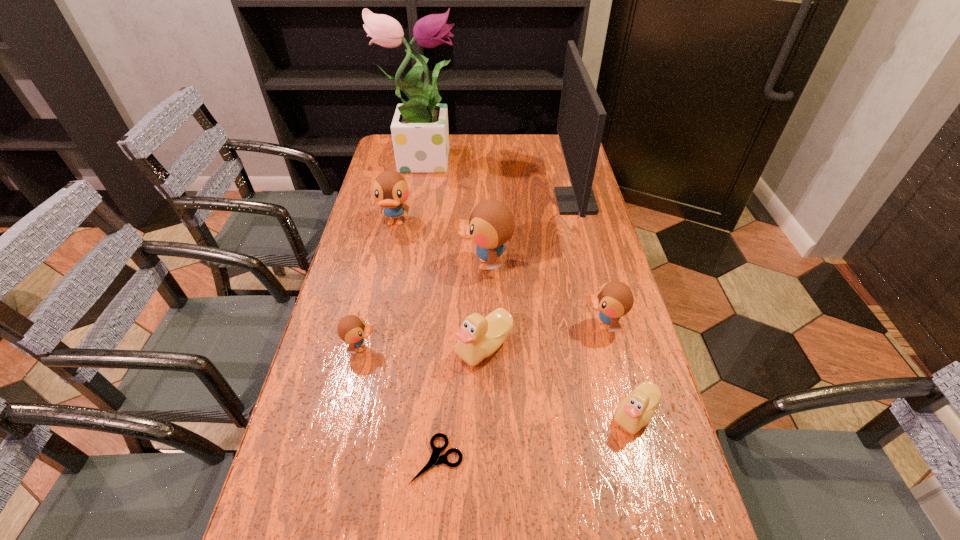
Where is `vacant space located at the beak of the nearest duck`? vacant space located at the beak of the nearest duck is located at coordinates (496, 414).

This screenshot has height=540, width=960. I want to click on vacant space located 0.260m at the beak of the nearest duck, so click(492, 414).

Where is `free spot located on the left of the shears`? free spot located on the left of the shears is located at coordinates (323, 459).

Image resolution: width=960 pixels, height=540 pixels. In order to click on flower arrangement located at the far edge in this screenshot , I will do 420,134.

The width and height of the screenshot is (960, 540). What are the coordinates of `computer monitor that is positioned at the far edge` in the screenshot? It's located at tap(581, 120).

This screenshot has height=540, width=960. What are the coordinates of `flower arrangement that is positioned at the left edge` in the screenshot? It's located at (420, 134).

The width and height of the screenshot is (960, 540). Find the location of `computer monitor located in the right edge section of the desktop`. computer monitor located in the right edge section of the desktop is located at coordinates (581, 120).

Where is `object that is positioned at the far left corner`? object that is positioned at the far left corner is located at coordinates (420, 134).

Identify the location of object positioned at the far right corner. This screenshot has height=540, width=960. (581, 120).

Locate an element on the screen. free space at the left edge of the desktop is located at coordinates (362, 265).